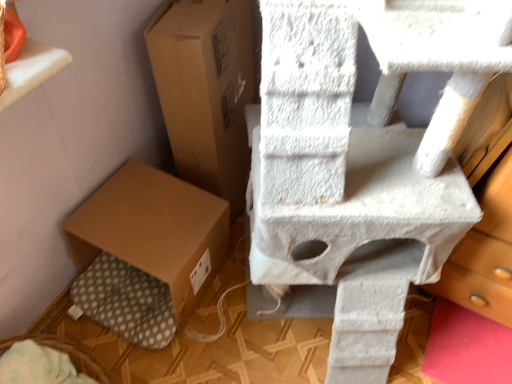
Question: Considering the relative positions of white textured cat tree at upper right and brown cardboard box at lower left, the second cardboard box in the top-to-bottom sequence, in the image provided, is white textured cat tree at upper right in front of brown cardboard box at lower left, the second cardboard box in the top-to-bottom sequence,?

Choices:
 (A) yes
 (B) no

Answer: (A)

Question: Does white textured cat tree at upper right appear on the right side of brown cardboard box at lower left, arranged as the first cardboard box when ordered from the bottom?

Choices:
 (A) yes
 (B) no

Answer: (A)

Question: Can brown cardboard box at lower left, arranged as the first cardboard box when ordered from the bottom, be found inside white textured cat tree at upper right?

Choices:
 (A) yes
 (B) no

Answer: (B)

Question: From a real-world perspective, is white textured cat tree at upper right beneath brown cardboard box at lower left, arranged as the first cardboard box when ordered from the bottom?

Choices:
 (A) yes
 (B) no

Answer: (B)

Question: Are white textured cat tree at upper right and brown cardboard box at lower left, arranged as the first cardboard box when ordered from the bottom, far apart?

Choices:
 (A) yes
 (B) no

Answer: (B)

Question: In terms of width, does brown cardboard box at center, marked as the 2th cardboard box in a bottom-to-top arrangement, look wider or thinner when compared to white textured cat tree at upper right?

Choices:
 (A) thin
 (B) wide

Answer: (B)

Question: Looking at the image, does brown cardboard box at center, marked as the 2th cardboard box in a bottom-to-top arrangement, seem bigger or smaller compared to white textured cat tree at upper right?

Choices:
 (A) small
 (B) big

Answer: (B)

Question: From a real-world perspective, is brown cardboard box at center, the 1th cardboard box when ordered from top to bottom, positioned above or below white textured cat tree at upper right?

Choices:
 (A) above
 (B) below

Answer: (B)

Question: Would you say brown cardboard box at center, marked as the 2th cardboard box in a bottom-to-top arrangement, is to the left or to the right of white textured cat tree at upper right in the picture?

Choices:
 (A) left
 (B) right

Answer: (A)

Question: Would you say white textured cat tree at upper right is to the left or to the right of brown cardboard box at center, marked as the 2th cardboard box in a bottom-to-top arrangement, in the picture?

Choices:
 (A) right
 (B) left

Answer: (A)

Question: Looking at the image, does white textured cat tree at upper right seem bigger or smaller compared to brown cardboard box at center, the 1th cardboard box when ordered from top to bottom?

Choices:
 (A) big
 (B) small

Answer: (B)

Question: From the image's perspective, is white textured cat tree at upper right located above or below brown cardboard box at center, the 1th cardboard box when ordered from top to bottom?

Choices:
 (A) above
 (B) below

Answer: (B)

Question: From a real-world perspective, is white textured cat tree at upper right above or below brown cardboard box at center, the 1th cardboard box when ordered from top to bottom?

Choices:
 (A) above
 (B) below

Answer: (A)

Question: In terms of size, does brown cardboard box at center, the 1th cardboard box when ordered from top to bottom, appear bigger or smaller than brown cardboard box at lower left, arranged as the first cardboard box when ordered from the bottom?

Choices:
 (A) big
 (B) small

Answer: (A)

Question: In terms of height, does brown cardboard box at center, the 1th cardboard box when ordered from top to bottom, look taller or shorter compared to brown cardboard box at lower left, the second cardboard box in the top-to-bottom sequence?

Choices:
 (A) tall
 (B) short

Answer: (A)